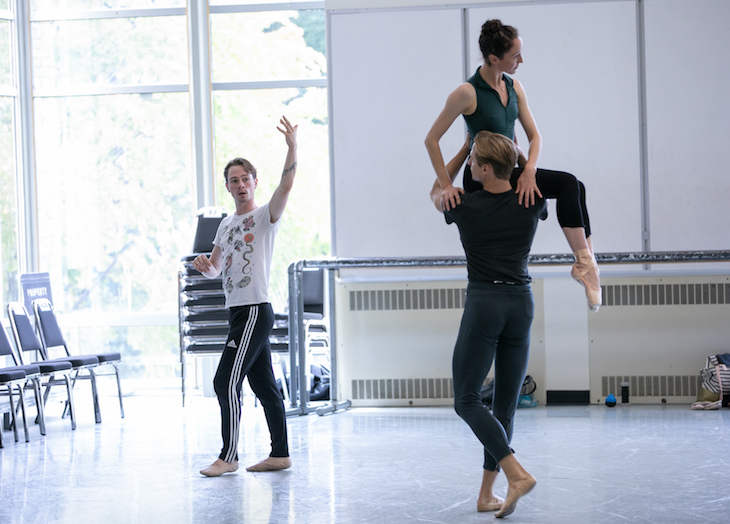
This screenshot has height=524, width=730. Find the location of `windows that show outside`. windows that show outside is located at coordinates (115, 176), (3, 178), (4, 57), (53, 45), (234, 37), (269, 140).